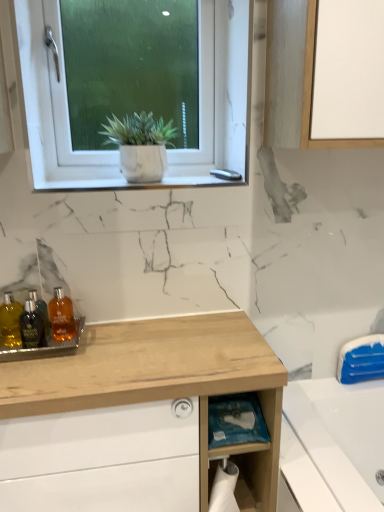
The width and height of the screenshot is (384, 512). What are the coordinates of `free spot in front of translucent plastic bottles at lower left, which ranks as the second toiletry in left-to-right order` in the screenshot? It's located at (41, 375).